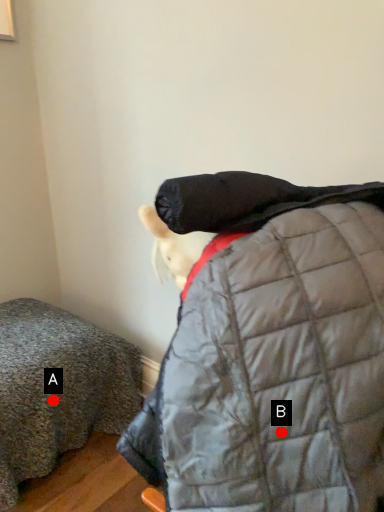
Question: Two points are circled on the image, labeled by A and B beside each circle. Which point is further to the camera?

Choices:
 (A) A is further
 (B) B is further

Answer: (A)